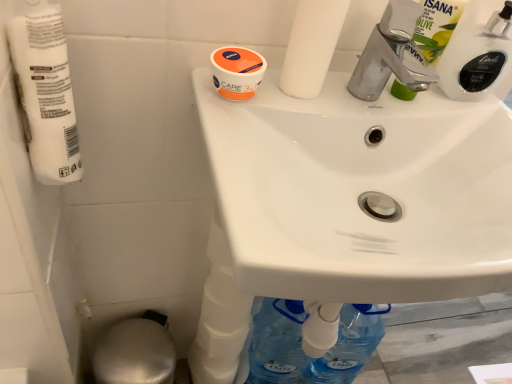
Locate an element on the screen. This screenshot has width=512, height=384. free point above silver metallic bidet at lower left (from a real-world perspective) is located at coordinates click(134, 354).